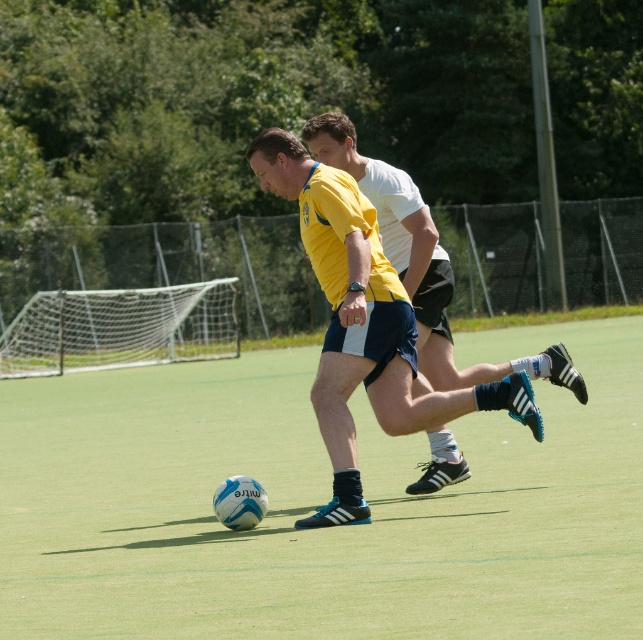
You are a soccer coach analyzing the field layout. The green artificial turf at center is where the ball is placed for a free kick. The matte blue shorts at center belong to an opponent player. If the ball must be at least 20 feet away from any opposing player, is the current distance compliant with the rule?

The distance between the green artificial turf at center and the matte blue shorts at center is 17.25 feet, which is less than the required 20 feet. Therefore, the current distance does not comply with the rule.

You are a soccer player standing on the field. You notice the green artificial turf at center and the matte blue shorts at center. Which object is higher in height?

The green artificial turf at center is taller than the matte blue shorts at center.

You are a soccer player wearing the matte blue shorts at center. You want to kick the ball towards the goal located at the far end of the field. Considering the green artificial turf at center is under your shorts, where should you position your foot to ensure a clear shot?

The green artificial turf at center is positioned under the matte blue shorts at center, so you should place your foot on the green artificial turf at center to ensure a stable and clear shot towards the goal.